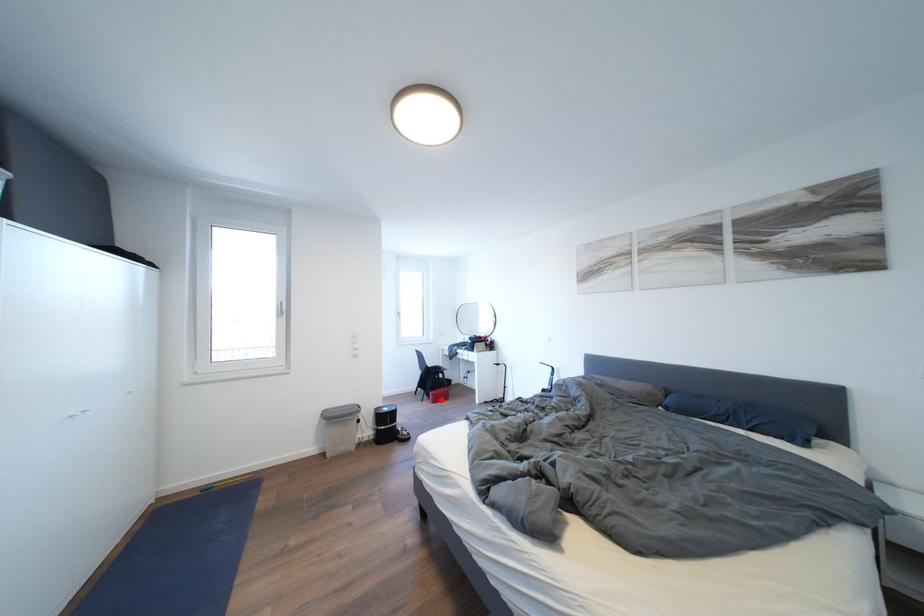
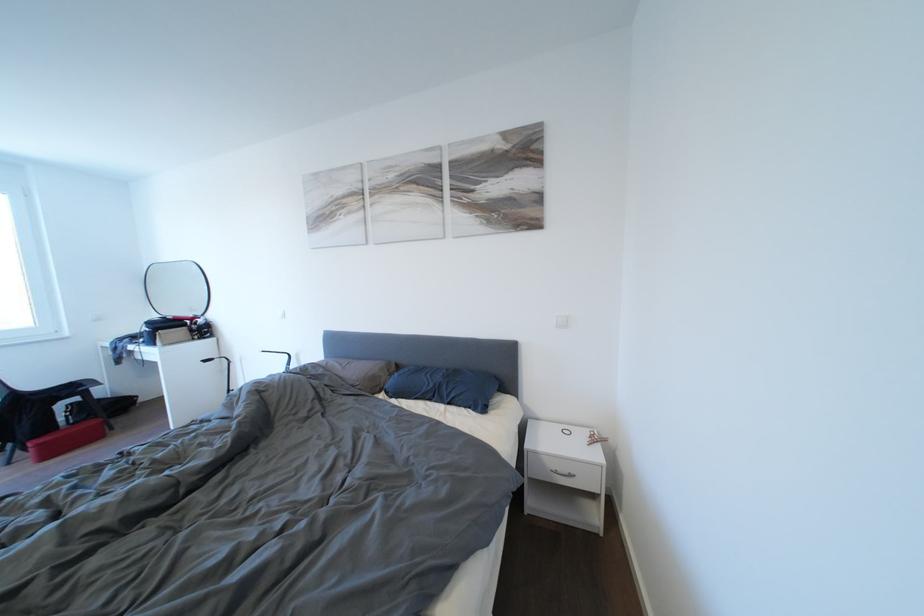
Question: I am providing you with two images of the same scene from different viewpoints. In image1, a red point is highlighted. Considering the same 3D point in image2, which of the following is correct?

Choices:
 (A) It is closer
 (B) It is farther

Answer: (A)